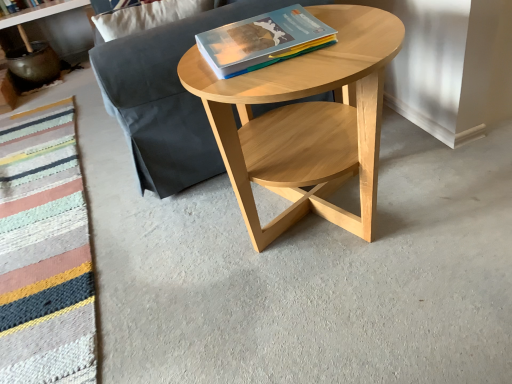
Question: Is matte white shelf at upper left wider than knitted wool blanket at lower left?

Choices:
 (A) no
 (B) yes

Answer: (A)

Question: From the image's perspective, is matte white shelf at upper left above knitted wool blanket at lower left?

Choices:
 (A) yes
 (B) no

Answer: (A)

Question: Is matte white shelf at upper left looking in the opposite direction of knitted wool blanket at lower left?

Choices:
 (A) yes
 (B) no

Answer: (B)

Question: Is matte white shelf at upper left far from knitted wool blanket at lower left?

Choices:
 (A) yes
 (B) no

Answer: (A)

Question: Is matte white shelf at upper left smaller than knitted wool blanket at lower left?

Choices:
 (A) no
 (B) yes

Answer: (B)

Question: Is matte white shelf at upper left in front of or behind natural wood coffee table at center in the image?

Choices:
 (A) front
 (B) behind

Answer: (B)

Question: From a real-world perspective, is matte white shelf at upper left physically located above or below natural wood coffee table at center?

Choices:
 (A) below
 (B) above

Answer: (B)

Question: Based on their positions, is matte white shelf at upper left located to the left or right of natural wood coffee table at center?

Choices:
 (A) left
 (B) right

Answer: (A)

Question: From the image's perspective, relative to natural wood coffee table at center, is matte white shelf at upper left above or below?

Choices:
 (A) below
 (B) above

Answer: (B)

Question: From the image's perspective, is matte paper book at center above or below dark gray fabric couch at center?

Choices:
 (A) below
 (B) above

Answer: (A)

Question: From a real-world perspective, is matte paper book at center above or below dark gray fabric couch at center?

Choices:
 (A) above
 (B) below

Answer: (A)

Question: Visually, is matte paper book at center positioned to the left or to the right of dark gray fabric couch at center?

Choices:
 (A) right
 (B) left

Answer: (A)

Question: Relative to dark gray fabric couch at center, is matte paper book at center in front or behind?

Choices:
 (A) behind
 (B) front

Answer: (B)

Question: Based on their positions, is dark gray fabric couch at center located to the left or right of natural wood coffee table at center?

Choices:
 (A) right
 (B) left

Answer: (B)

Question: Considering the positions of point (179, 84) and point (230, 77), is point (179, 84) closer or farther from the camera than point (230, 77)?

Choices:
 (A) closer
 (B) farther

Answer: (B)